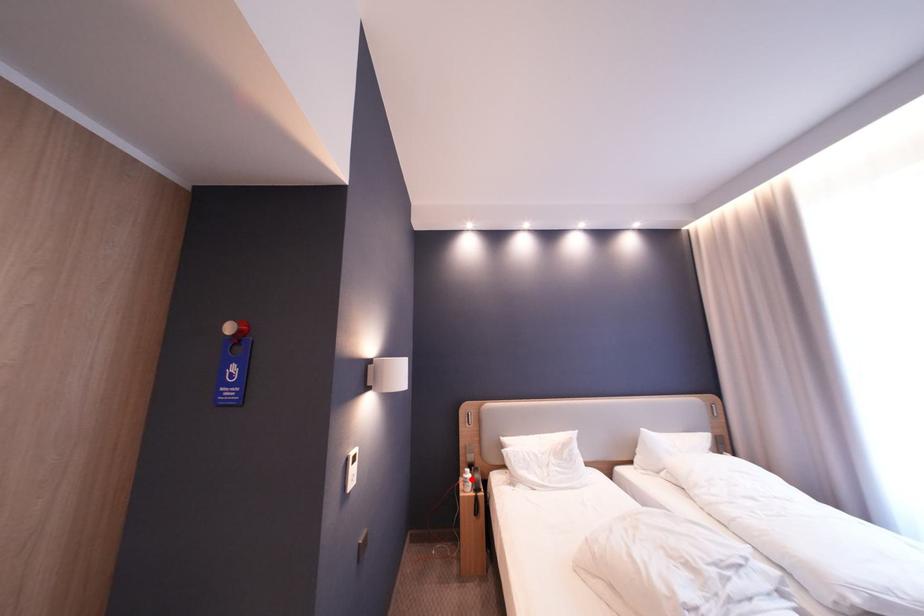
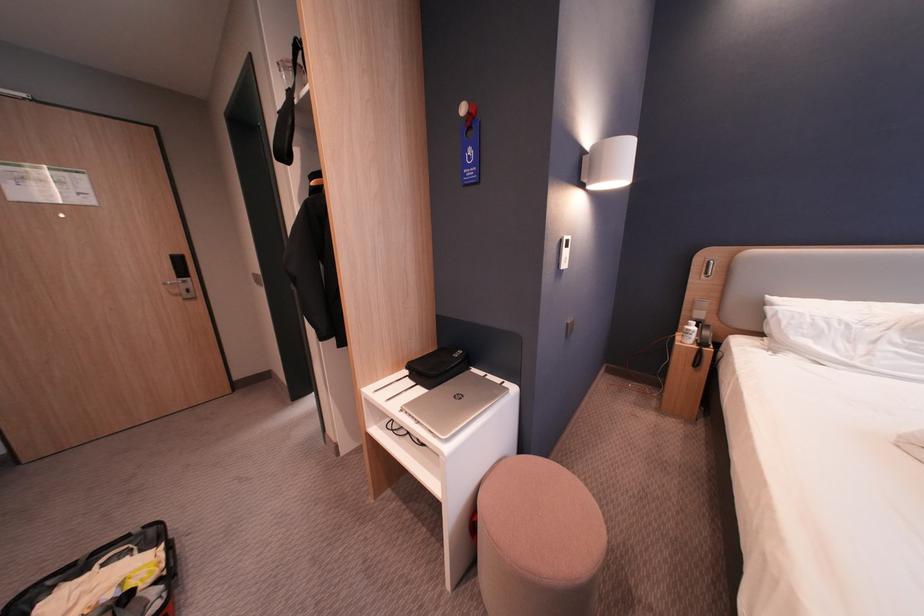
In the second image, find the point that corresponds to the highlighted location in the first image.

(688, 334)